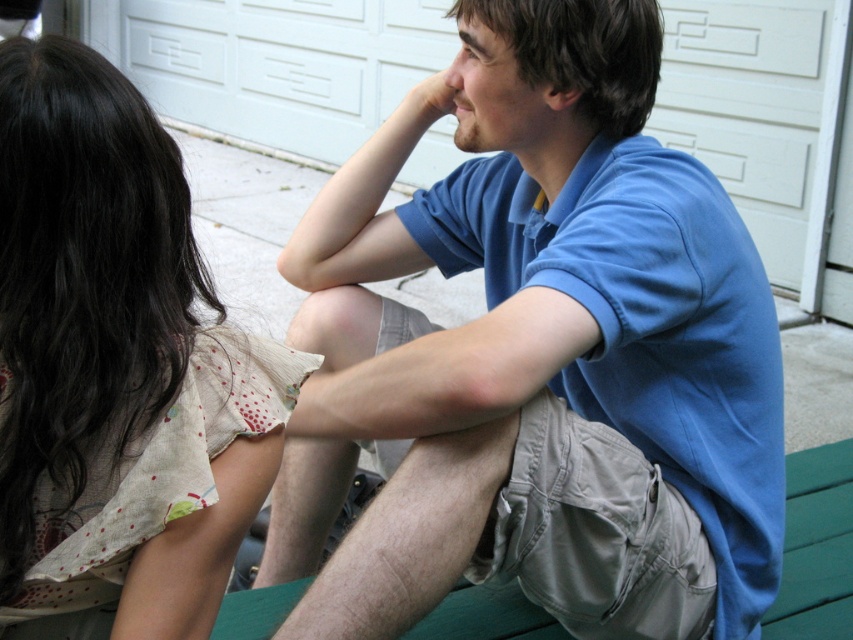
Does white textured garage door at upper center have a smaller size compared to matte skin hand at upper center?

No, white textured garage door at upper center is not smaller than matte skin hand at upper center.

Is point (363, 51) positioned in front of point (422, 90)?

No, (363, 51) is behind (422, 90).

Where is `white textured garage door at upper center`? The image size is (853, 640). white textured garage door at upper center is located at coordinates click(770, 129).

Does blue cotton shirt at center have a smaller size compared to matte skin hand at upper center?

Incorrect, blue cotton shirt at center is not smaller in size than matte skin hand at upper center.

Is blue cotton shirt at center shorter than matte skin hand at upper center?

Incorrect, blue cotton shirt at center's height does not fall short of matte skin hand at upper center's.

Who is more forward, (339,314) or (416,112)?

Point (416,112) is more forward.

The image size is (853, 640). Identify the location of blue cotton shirt at center. (538, 358).

Can you confirm if blue cotton shirt at center is positioned below white textured garage door at upper center?

Indeed, blue cotton shirt at center is positioned under white textured garage door at upper center.

Between blue cotton shirt at center and white textured garage door at upper center, which one is positioned higher?

white textured garage door at upper center is higher up.

Measure the distance between point [642,316] and camera.

Point [642,316] and camera are 1.18 meters apart from each other.

The width and height of the screenshot is (853, 640). In order to click on blue cotton shirt at center in this screenshot , I will do `click(538, 358)`.